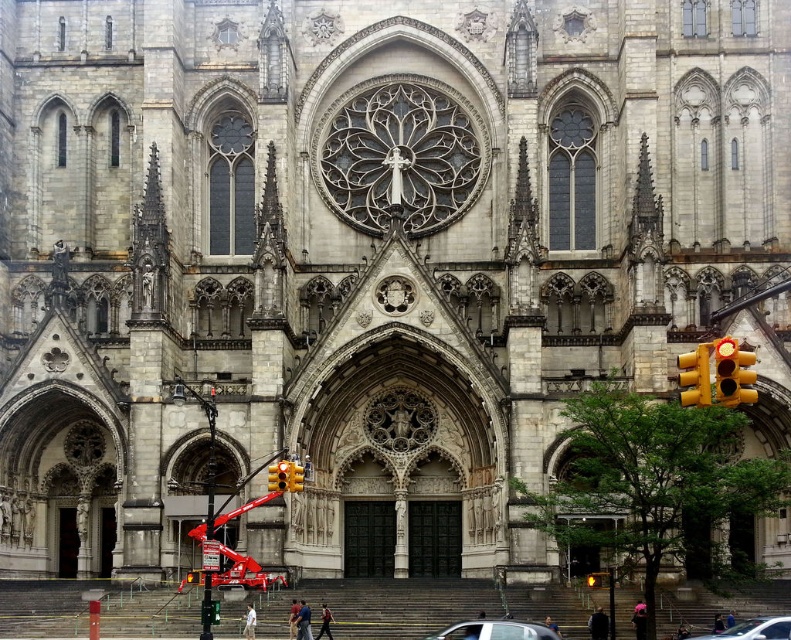
Who is taller, silver metallic car at center or yellow plastic traffic light at right?

Standing taller between the two is yellow plastic traffic light at right.

Between silver metallic car at center and yellow plastic traffic light at right, which one is positioned lower?

Positioned lower is silver metallic car at center.

You are a GUI agent. You are given a task and a screenshot of the screen. Output one action in this format:
    pyautogui.click(x=<x>, y=<y>)
    Task: Click on the silver metallic car at center
    This screenshot has height=640, width=791.
    Given the screenshot: What is the action you would take?
    pyautogui.click(x=494, y=630)

Measure the distance between point (498,632) and camera.

Point (498,632) and camera are 69.07 meters apart from each other.

You are a GUI agent. You are given a task and a screenshot of the screen. Output one action in this format:
    pyautogui.click(x=<x>, y=<y>)
    Task: Click on the silver metallic car at center
    Image resolution: width=791 pixels, height=640 pixels.
    Given the screenshot: What is the action you would take?
    pyautogui.click(x=494, y=630)

Is yellow plastic traffic light at right above yellow plastic traffic light at center right?

Indeed, yellow plastic traffic light at right is positioned over yellow plastic traffic light at center right.

Which is behind, point (680, 384) or point (290, 490)?

Point (290, 490)

Is point (687, 376) closer to camera compared to point (294, 483)?

Yes, it is.

Where is `yellow plastic traffic light at right`? The width and height of the screenshot is (791, 640). yellow plastic traffic light at right is located at coordinates (695, 376).